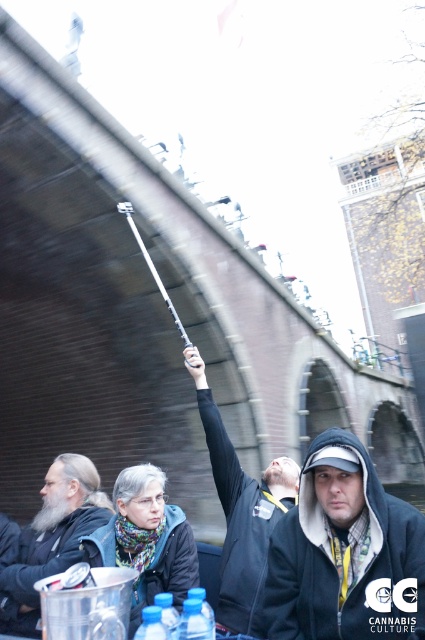
Question: Which point is farther to the camera?

Choices:
 (A) (258, 556)
 (B) (356, 444)
 (C) (98, 480)

Answer: (C)

Question: Where is black matte jacket at upper center located in relation to bearded man at left in the image?

Choices:
 (A) above
 (B) below

Answer: (A)

Question: Is dark gray hoodie at center closer to camera compared to black matte jacket at upper center?

Choices:
 (A) no
 (B) yes

Answer: (B)

Question: Which object is positioned farthest from the bearded man at left?

Choices:
 (A) dark gray hoodie at center
 (B) black matte jacket at upper center

Answer: (A)

Question: Which point is closer to the camera?

Choices:
 (A) black matte jacket at upper center
 (B) bearded man at left

Answer: (A)

Question: Observing the image, what is the correct spatial positioning of dark gray hoodie at center in reference to bearded man at left?

Choices:
 (A) above
 (B) below

Answer: (A)